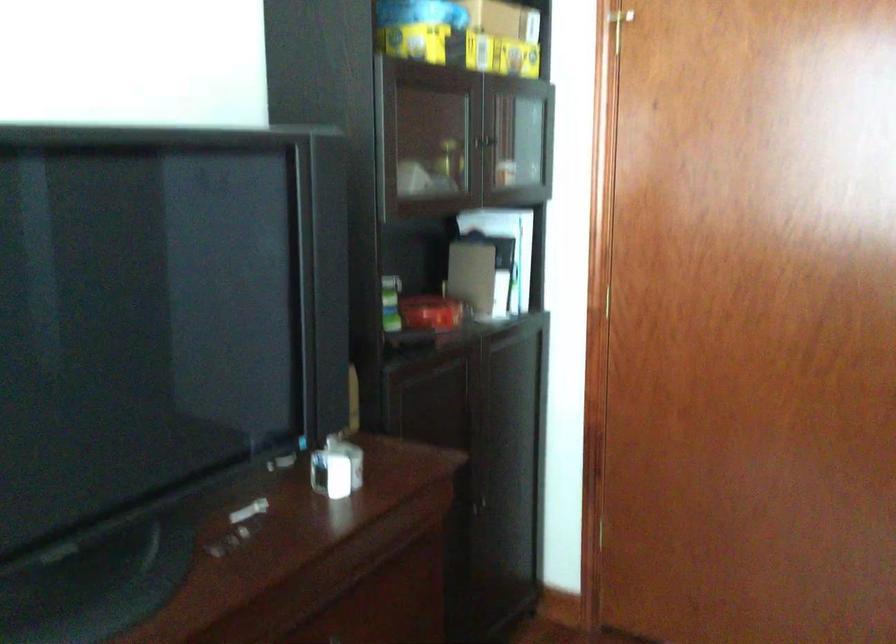
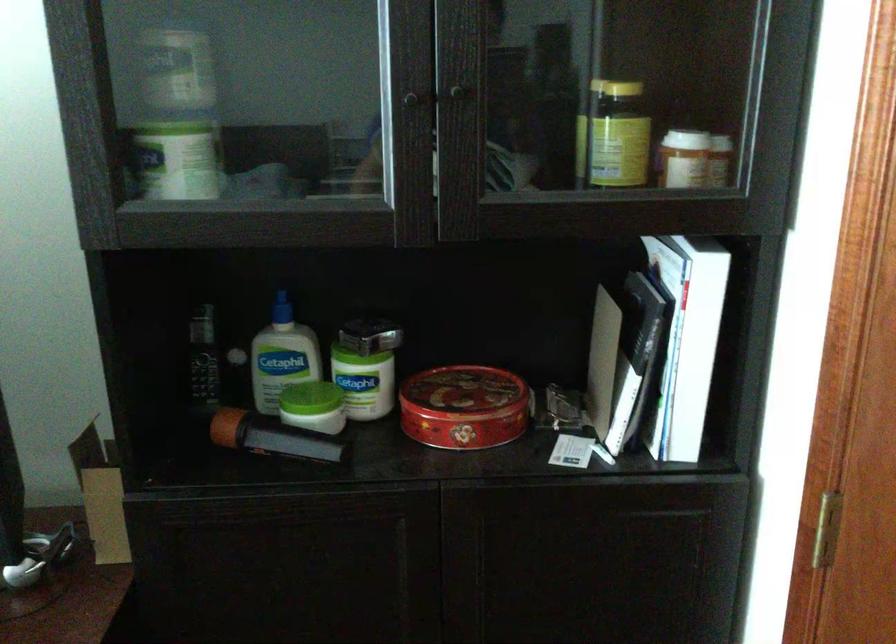
Where in the second image is the point corresponding to point (541, 353) from the first image?

(707, 554)